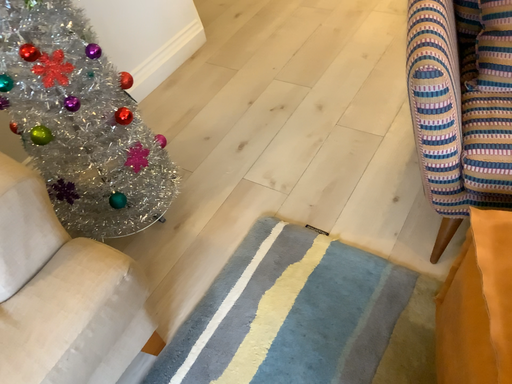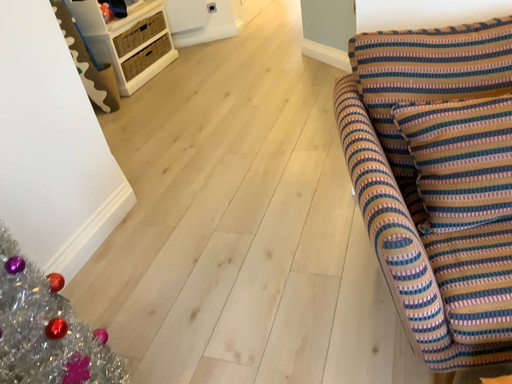
Question: Which way did the camera rotate in the video?

Choices:
 (A) rotated left
 (B) rotated right

Answer: (B)